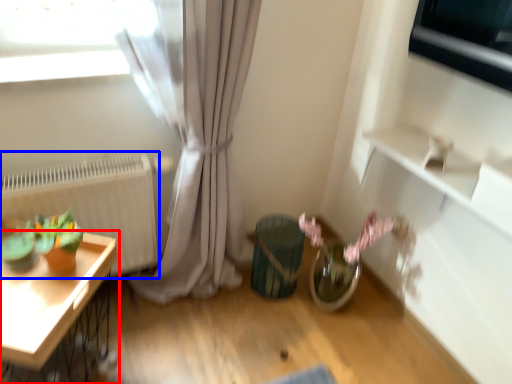
Question: Which of the following is the closest to the observer, table (highlighted by a red box) or radiator (highlighted by a blue box)?

Choices:
 (A) table
 (B) radiator

Answer: (A)